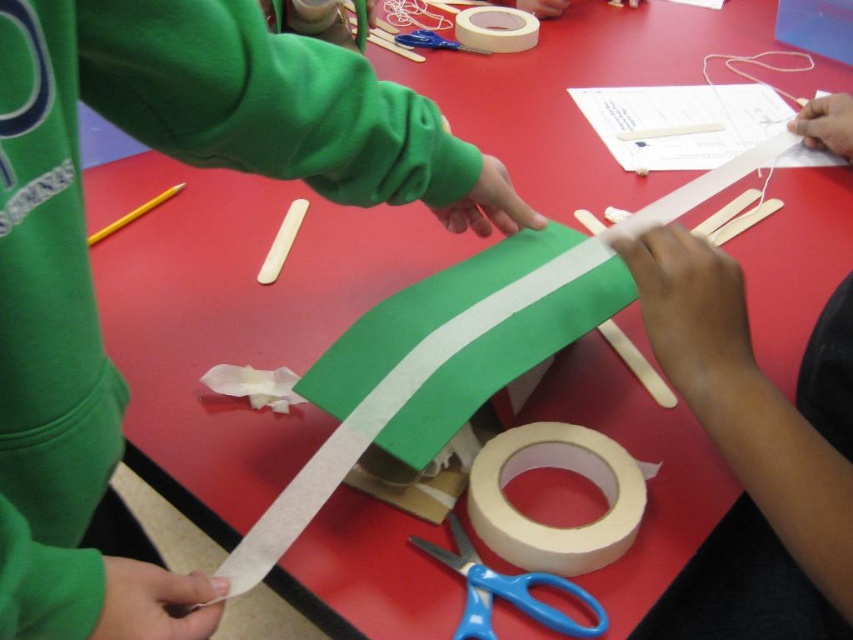
Consider the image. You are looking at the crafting table and see two points marked on the green rectangular material. Which point is closer to you, point (585, 540) or point (468, 612)?

Point (585, 540) is further to the viewer than point (468, 612), so point (468, 612) is closer to you.

You are a craft enthusiast who wants to reach the blue plastic scissors at lower center while standing at the table. Considering the distance, can you comfortably reach them without moving your body?

The blue plastic scissors at lower center are 21.64 inches away from the viewer, which is within a comfortable reaching distance for most people. Yes, you can comfortably reach them without moving your body.

You are a craft enthusiast working on a project at the red table. You need to attach the green rectangular piece with the white stripe to another part of your craft. Where should you place the matte white tape at center to secure it properly?

The matte white tape at center is located at point (550, 525), so you should place it there to secure the green rectangular piece with the white stripe properly.